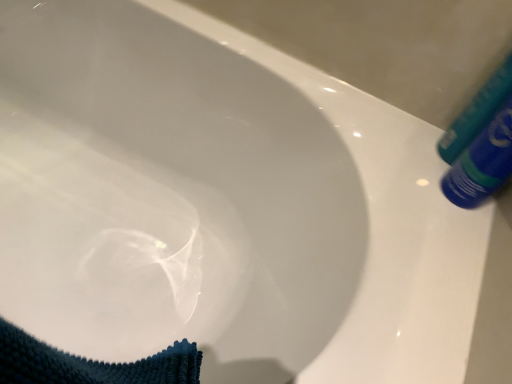
I want to click on vacant space situated on the left part of blue glossy tube at upper right, which appears as the first tube when ordered from the bottom, so click(x=392, y=149).